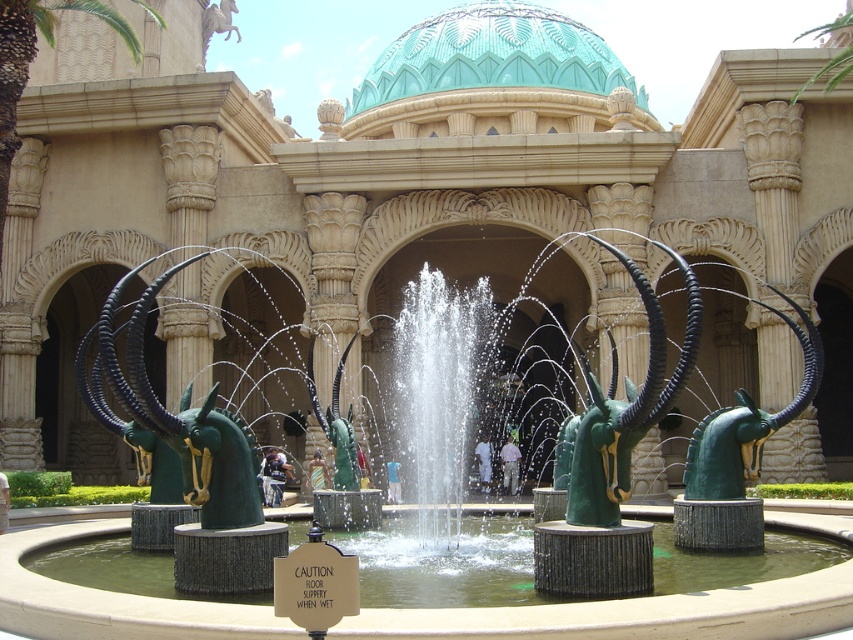
You are standing at the entrance of the grand structure and see the green polished stone fountain at center and the white matte person at center. Which object is closer to you?

The green polished stone fountain at center is closer to you because it is in front of the white matte person at center.

Looking at this image, you are a visitor standing at the entrance of the grand structure. You see the green polished stone fountain at center and the dark blue jeans at center. If you want to reach the fountain first, which object should you move towards first?

You should move towards the green polished stone fountain at center first because it is closer to you than the dark blue jeans at center. The distance between them is 17.96 meters, so the fountain is nearer.